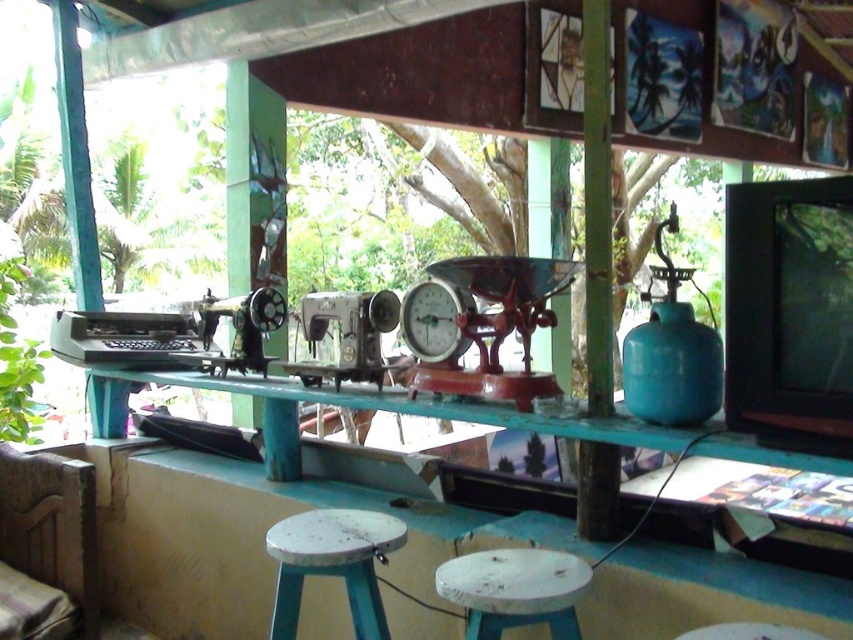
Question: From the image, what is the correct spatial relationship of green wood pole at center in relation to white painted wood stool at center?

Choices:
 (A) left
 (B) right

Answer: (B)

Question: Does green wood pole at center appear under white painted wood stool at center?

Choices:
 (A) yes
 (B) no

Answer: (B)

Question: Among these objects, which one is nearest to the camera?

Choices:
 (A) white painted wood stool at lower center
 (B) metallic scale at center

Answer: (A)

Question: Among these points, which one is nearest to the camera?

Choices:
 (A) (602, 531)
 (B) (345, 564)
 (C) (544, 588)
 (D) (426, 358)

Answer: (C)

Question: Which point appears closest to the camera in this image?

Choices:
 (A) (508, 321)
 (B) (593, 189)

Answer: (B)

Question: Is metallic scale at center below white painted wood stool at lower center?

Choices:
 (A) yes
 (B) no

Answer: (B)